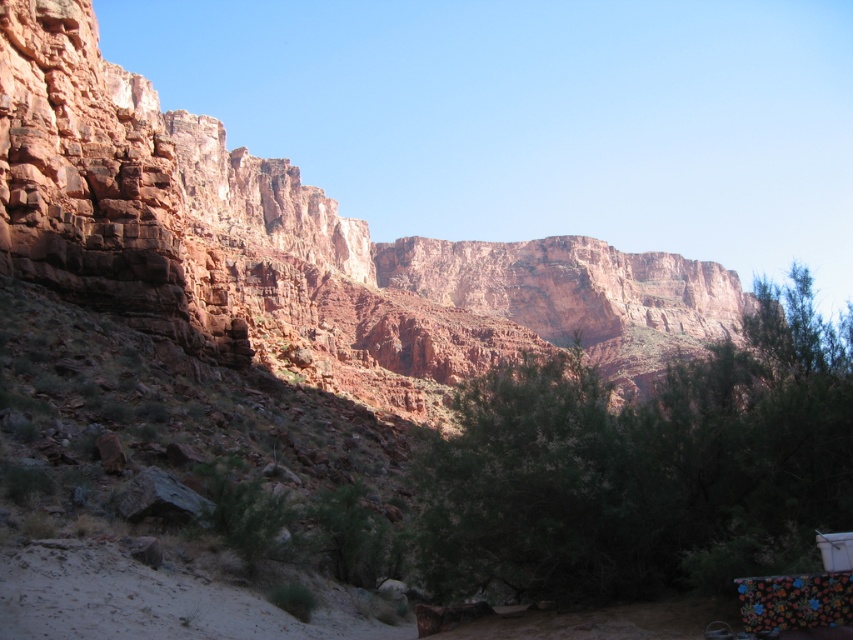
You are a hiker planning to traverse from the rustic rock formation at upper left to the green leafy tree at center. Given that your average walking speed is 3 miles per hour, how long would it take you to reach the tree from the rock formation?

The distance between rustic rock formation at upper left and green leafy tree at center is 262.64 feet. Converting feet to miles, 262.64 feet is approximately 0.05 miles. At a walking speed of 3 mph, the time taken would be roughly 0.05 miles divided by 3 mph, which equals about 1 minute. Therefore, it would take approximately 1 minute to reach the green leafy tree at center from the rustic rock formation at upper left.

You are an explorer in the desert and need to find shade. You see the rustic rock formation at upper left and the green leafy tree at center. Which one would provide more shade in terms of area covered?

The rustic rock formation at upper left has a larger width than the green leafy tree at center, so it would provide more shade in terms of area covered.

You are standing in the desert landscape and want to reach both points marked in the image. Which point, point [221,323] or point [737,365], will you reach first as you move forward?

You will reach point [221,323] first because it is closer to you than point [737,365], which is further away.